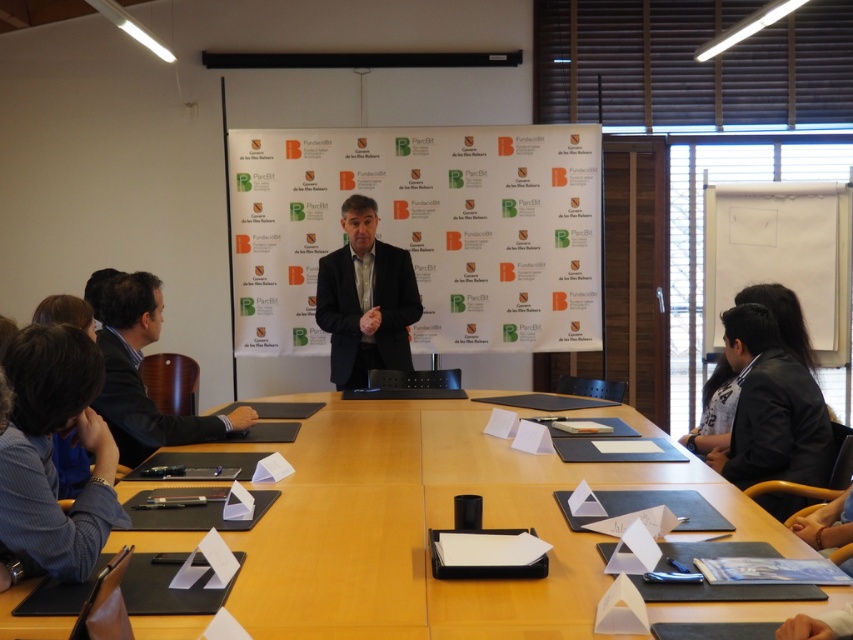
Question: Is wooden table at center positioned before black smooth suit at lower right?

Choices:
 (A) yes
 (B) no

Answer: (A)

Question: Can you confirm if wooden table at center is positioned above dark blue fabric business suit at left?

Choices:
 (A) yes
 (B) no

Answer: (B)

Question: Which of the following is the closest to the observer?

Choices:
 (A) (117, 337)
 (B) (767, 451)
 (C) (340, 340)

Answer: (B)

Question: Is wooden table at center thinner than white paperboard at upper right?

Choices:
 (A) yes
 (B) no

Answer: (B)

Question: Based on their relative distances, which object is farther from the wooden table at center?

Choices:
 (A) black smooth suit at lower right
 (B) white paperboard at upper right
 (C) dark gray woolen suit at center
 (D) dark blue fabric business suit at left

Answer: (B)

Question: Which object is the farthest from the dark gray woolen suit at center?

Choices:
 (A) blue shirt at left
 (B) black smooth suit at lower right
 (C) wooden table at center
 (D) matte black podium at center

Answer: (A)